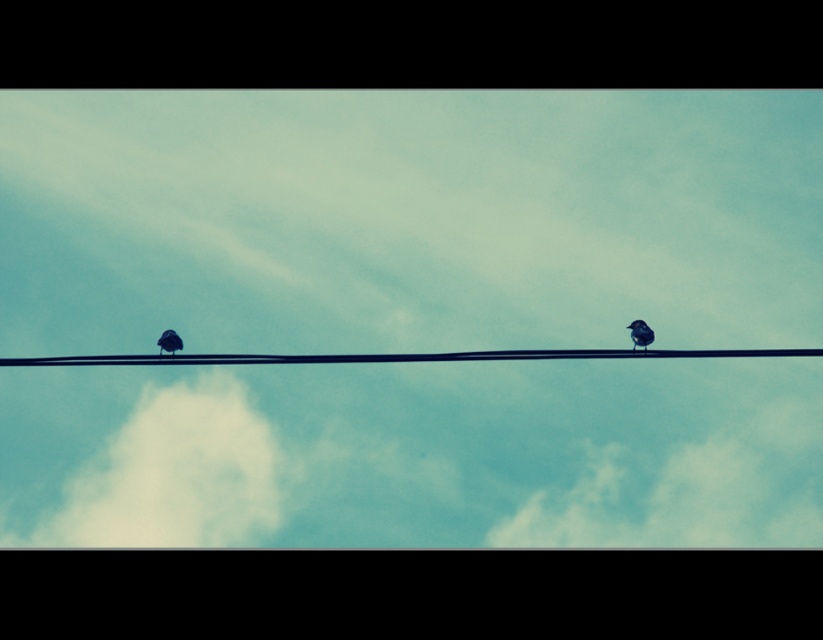
Question: Does white fluffy cloud at upper center appear over matte black bird at right?

Choices:
 (A) yes
 (B) no

Answer: (B)

Question: Among these objects, which one is farthest from the camera?

Choices:
 (A) white fluffy cloud at lower left
 (B) silvery metallic bird at left
 (C) white fluffy cloud at upper center
 (D) matte black bird at right

Answer: (C)

Question: Which is farther from the matte black bird at right?

Choices:
 (A) silvery metallic bird at left
 (B) black wire at center

Answer: (A)

Question: Does white fluffy cloud at upper center appear on the left side of black wire at center?

Choices:
 (A) yes
 (B) no

Answer: (B)

Question: Is white fluffy cloud at lower left above silvery metallic bird at left?

Choices:
 (A) no
 (B) yes

Answer: (A)

Question: Which point is closer to the camera taking this photo?

Choices:
 (A) click(x=719, y=468)
 (B) click(x=177, y=333)
 (C) click(x=636, y=324)

Answer: (C)